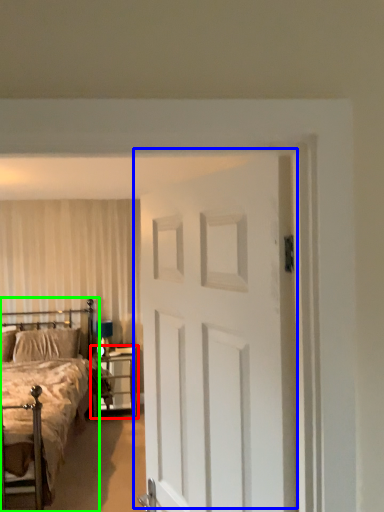
Question: Considering the real-world distances, which object is closest to nightstand (highlighted by a red box)? door (highlighted by a blue box) or bed (highlighted by a green box).

Choices:
 (A) door
 (B) bed

Answer: (B)